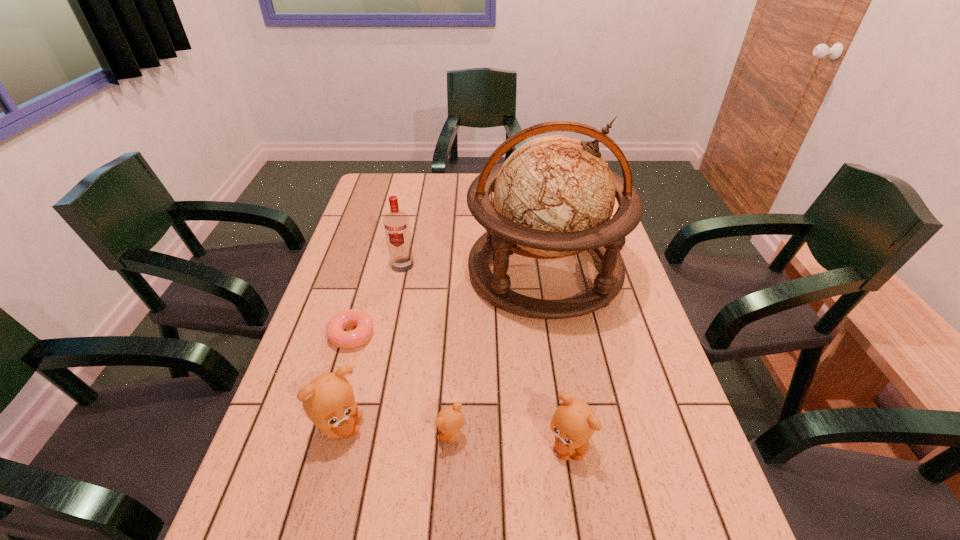
Identify the location of the leftmost teddy bear. Image resolution: width=960 pixels, height=540 pixels. (329, 402).

Identify the location of the shortest teddy bear. (450, 420).

I want to click on the second teddy bear from left to right, so click(x=450, y=420).

The image size is (960, 540). What are the coordinates of `the fourth tallest object` in the screenshot? It's located at (574, 422).

I want to click on the rightmost teddy bear, so click(574, 422).

The image size is (960, 540). Identify the location of vodka. (396, 223).

Where is `the tallest object`? This screenshot has width=960, height=540. the tallest object is located at coordinates (554, 196).

Where is `doughnut`? doughnut is located at coordinates click(x=335, y=332).

Where is `free space located on the face of the leftmost teddy bear`? free space located on the face of the leftmost teddy bear is located at coordinates (428, 428).

You are a GUI agent. You are given a task and a screenshot of the screen. Output one action in this format:
    pyautogui.click(x=<x>, y=<y>)
    Task: Click on the free space located on the face of the shortest teddy bear
    
    Given the screenshot: What is the action you would take?
    (x=287, y=436)